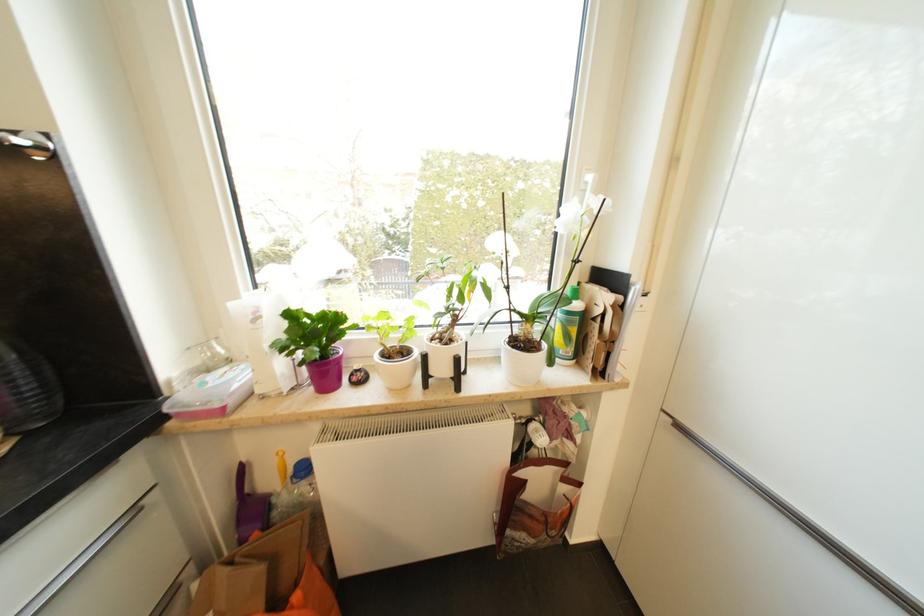
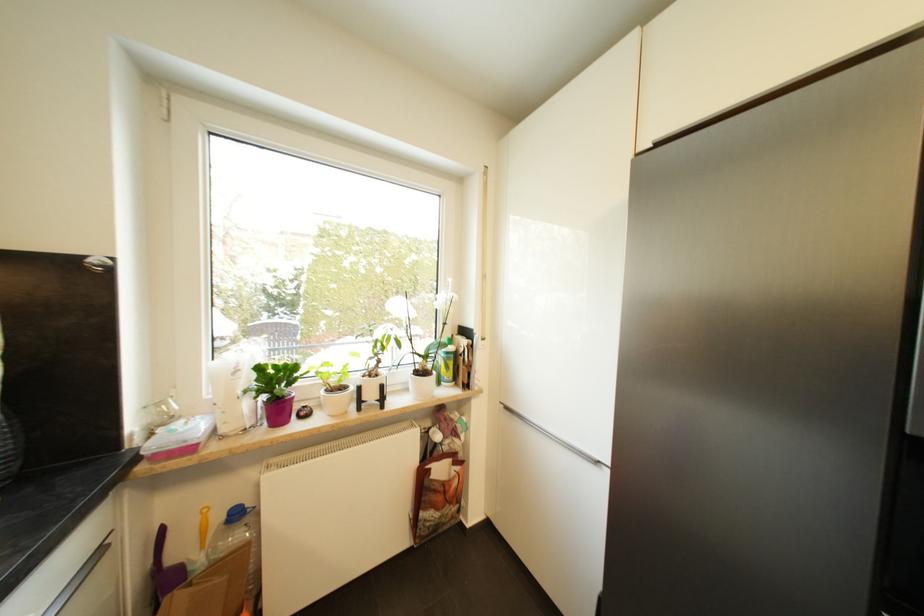
Where in the second image is the point corresponding to (392,357) from the first image?

(336, 392)